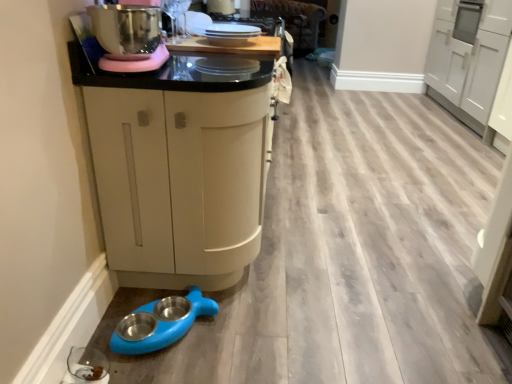
The image size is (512, 384). I want to click on free space between matte cream cabinet at center, acting as the 1th cabinetry starting from the front, and blue rubber pet bowls at lower left, so pyautogui.click(x=191, y=332).